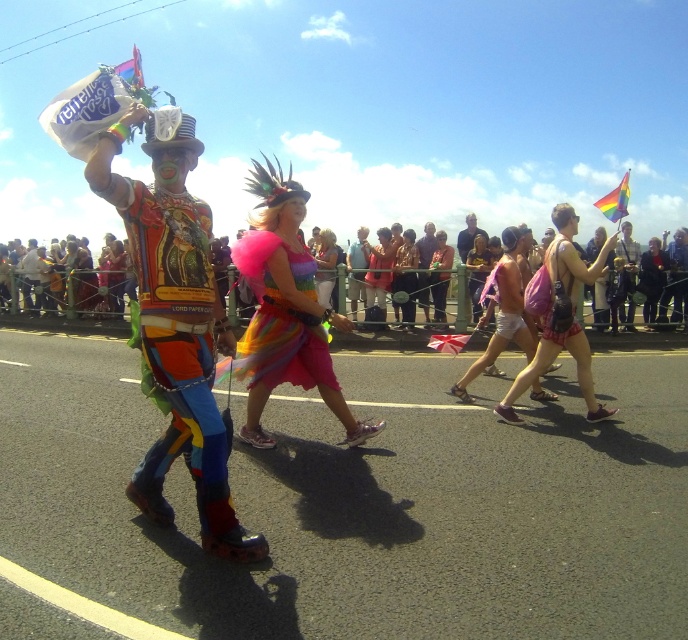
Is point (288, 234) closer to viewer compared to point (566, 310)?

Yes, it is in front of point (566, 310).

The height and width of the screenshot is (640, 688). Identify the location of rainbow tulle skirt at center. (286, 308).

Does point (250, 371) lie behind point (546, 250)?

No, it is in front of (546, 250).

Image resolution: width=688 pixels, height=640 pixels. I want to click on rainbow tulle dress at center, so click(279, 320).

Which is behind, point (301, 192) or point (574, 328)?

Positioned behind is point (574, 328).

This screenshot has height=640, width=688. Describe the element at coordinates (286, 308) in the screenshot. I see `rainbow tulle skirt at center` at that location.

Between point (237, 260) and point (572, 280), which one is positioned behind?

The point (572, 280) is more distant.

Where is `rainbow tulle skirt at center`? rainbow tulle skirt at center is located at coordinates (x=286, y=308).